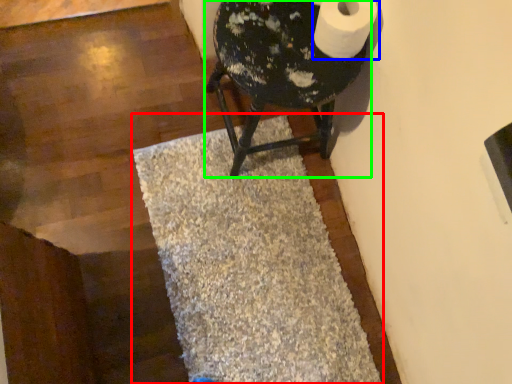
Question: Based on their relative distances, which object is nearer to bath mat (highlighted by a red box)? Choose from toilet paper (highlighted by a blue box) and furniture (highlighted by a green box).

Choices:
 (A) toilet paper
 (B) furniture

Answer: (B)